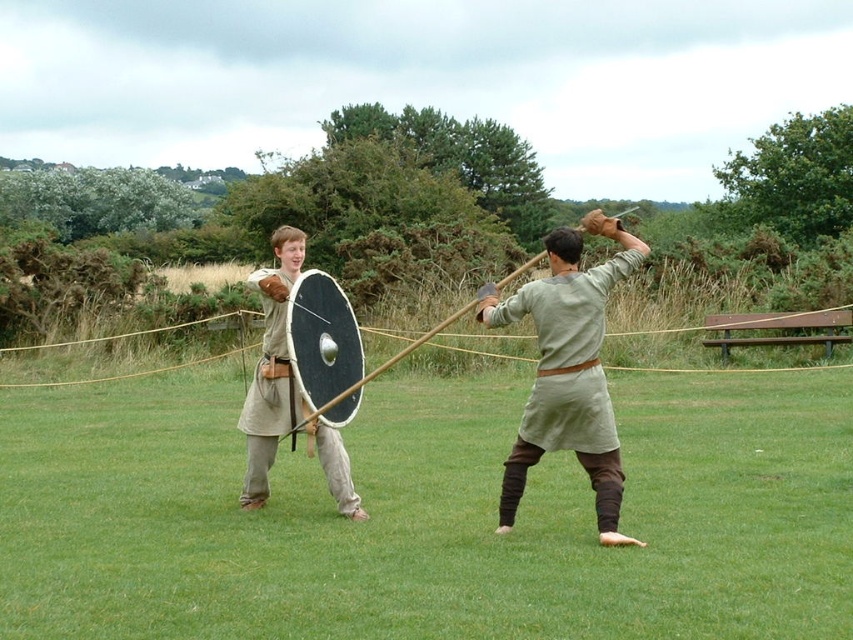
Between green grass at center and light gray fabric sword at center, which one appears on the right side from the viewer's perspective?

From the viewer's perspective, light gray fabric sword at center appears more on the right side.

You are a GUI agent. You are given a task and a screenshot of the screen. Output one action in this format:
    pyautogui.click(x=<x>, y=<y>)
    Task: Click on the green grass at center
    The image size is (853, 640).
    Given the screenshot: What is the action you would take?
    pyautogui.click(x=428, y=516)

Identify the location of green grass at center. (428, 516).

Does point (538, 416) come closer to viewer compared to point (263, 397)?

Yes, it is.

Can you confirm if light gray fabric sword at center is bigger than light beige fabric shield at center?

Actually, light gray fabric sword at center might be smaller than light beige fabric shield at center.

This screenshot has width=853, height=640. I want to click on light gray fabric sword at center, so click(567, 369).

Who is positioned more to the right, green grass at center or light beige fabric shield at center?

Positioned to the right is green grass at center.

Does green grass at center have a lesser width compared to light beige fabric shield at center?

No, green grass at center is not thinner than light beige fabric shield at center.

Which is behind, point (157, 490) or point (252, 506)?

The point (157, 490) is behind.

Locate an element on the screen. The width and height of the screenshot is (853, 640). green grass at center is located at coordinates pyautogui.click(x=428, y=516).